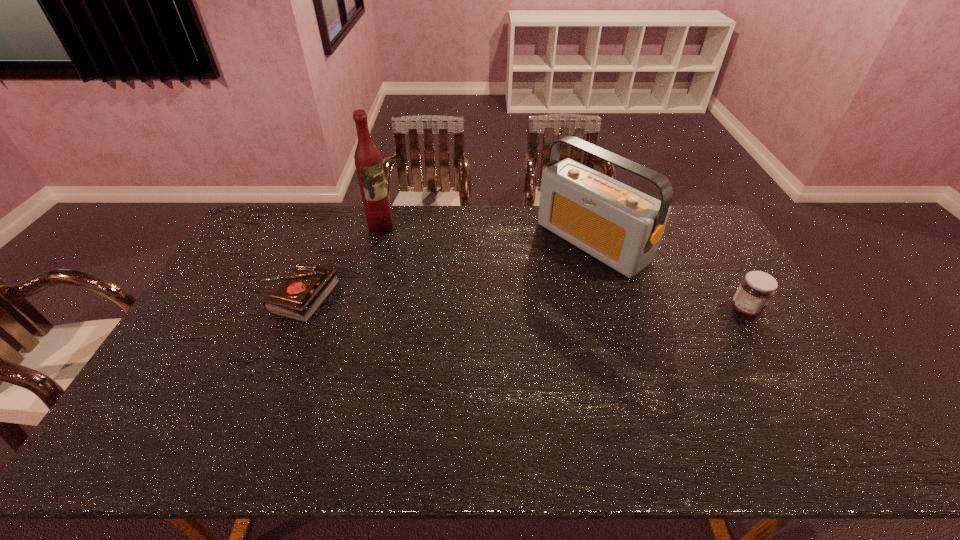
Locate an element on the screen. This screenshot has height=540, width=960. the leftmost object is located at coordinates (300, 294).

Identify the location of diary. (300, 294).

Where is `the rightmost object`? This screenshot has width=960, height=540. the rightmost object is located at coordinates (755, 291).

Identify the location of the second shortest object. The height and width of the screenshot is (540, 960). (755, 291).

Locate an element on the screen. The height and width of the screenshot is (540, 960). the tallest object is located at coordinates (368, 161).

The width and height of the screenshot is (960, 540). Identify the location of the third object from right to left. (368, 161).

The height and width of the screenshot is (540, 960). Find the location of `the second object from right to left`. the second object from right to left is located at coordinates [x=622, y=227].

Where is `radio receiver`? This screenshot has height=540, width=960. radio receiver is located at coordinates (622, 227).

The height and width of the screenshot is (540, 960). Find the location of `vacant space situated 0.090m on the left of the diary`. vacant space situated 0.090m on the left of the diary is located at coordinates (236, 296).

In order to click on free location located on the label of the second object from left to right in this screenshot , I will do `click(444, 289)`.